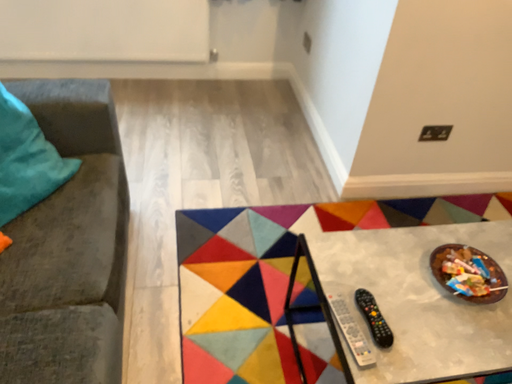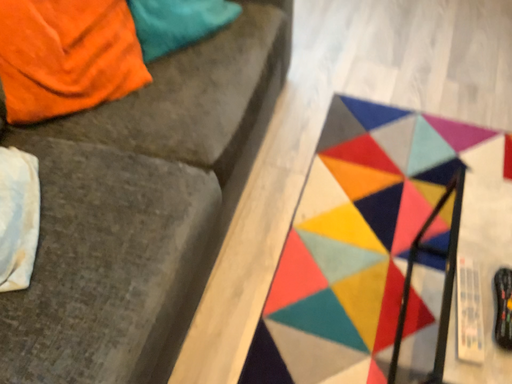
Question: Which way did the camera rotate in the video?

Choices:
 (A) rotated downward
 (B) rotated upward

Answer: (A)